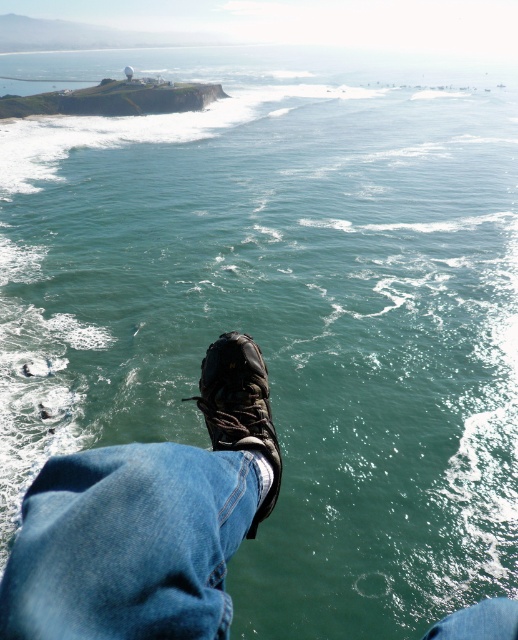
You are standing on a cliff and want to place a 1.2 meter long hiking pole between the black leather boot at center and the smooth concrete cliff at upper left. Can the pole fit horizontally between them?

The black leather boot at center is shorter than the smooth concrete cliff at upper left, but the description does not provide the horizontal distance between them. Therefore, it is impossible to determine if the pole will fit.

You are standing at the edge of a cliff overlooking the ocean. You notice two footwear items at your feet. Which one is wider? The dark brown leather shoe at center or the black leather boot at center?

The dark brown leather shoe at center is wider than the black leather boot at center according to the description.

You are standing at the cliff edge looking at the ocean. There are two points marked on the cliff face in front of you. The first point is at coordinates point (50, 515) and the second point is at point (91, 102). Which point is closer to you?

Point (50, 515) is closer to the viewer than point (91, 102).